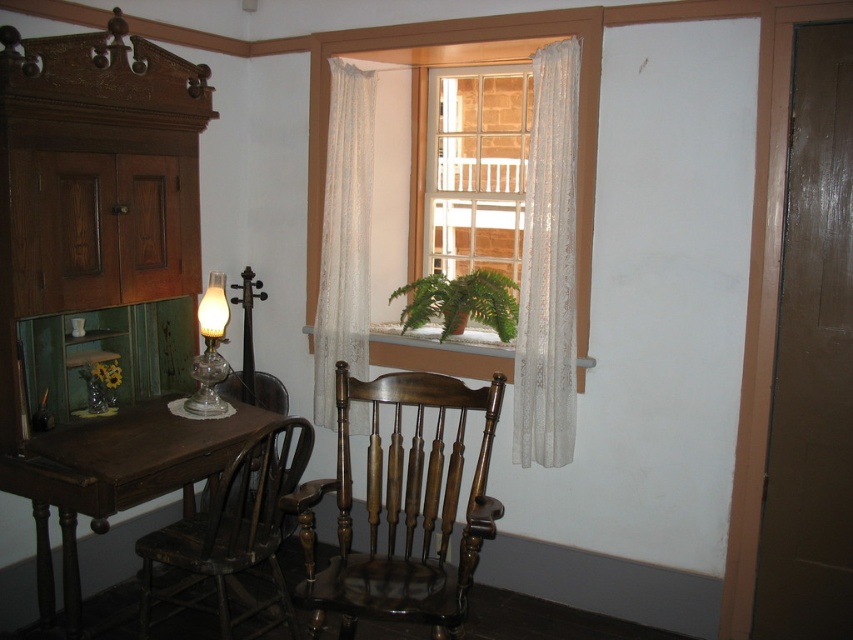
Question: Estimate the real-world distances between objects in this image. Which object is closer to the white lace curtain at right?

Choices:
 (A) transparent glass oil lamp at center
 (B) wooden at center
 (C) dark brown wood chair at lower left

Answer: (B)

Question: Observing the image, what is the correct spatial positioning of white lace curtain at center in reference to wooden rocking chair at center?

Choices:
 (A) left
 (B) right

Answer: (B)

Question: Can you confirm if white lace curtain at right is wider than dark brown wood chair at lower left?

Choices:
 (A) yes
 (B) no

Answer: (B)

Question: Is dark brown wood table at lower left closer to camera compared to transparent glass oil lamp at center?

Choices:
 (A) no
 (B) yes

Answer: (B)

Question: Which object is positioned farthest from the white lace curtain at center?

Choices:
 (A) clear glass window at center
 (B) wooden at center
 (C) white lace curtain at right
 (D) transparent glass oil lamp at center

Answer: (A)

Question: Which object appears farthest from the camera in this image?

Choices:
 (A) green matte plant at center
 (B) wooden at center

Answer: (A)